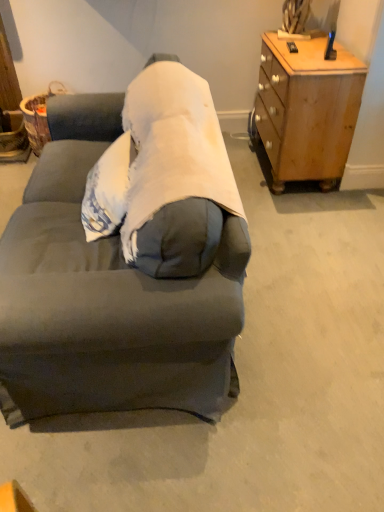
You are a GUI agent. You are given a task and a screenshot of the screen. Output one action in this format:
    pyautogui.click(x=<x>, y=<y>)
    Task: Click on the wooden chest of drawers at upper right
    
    Given the screenshot: What is the action you would take?
    pyautogui.click(x=307, y=109)

Describe the element at coordinates (307, 109) in the screenshot. The height and width of the screenshot is (512, 384). I see `wooden chest of drawers at upper right` at that location.

The height and width of the screenshot is (512, 384). I want to click on wooden chest of drawers at upper right, so click(x=307, y=109).